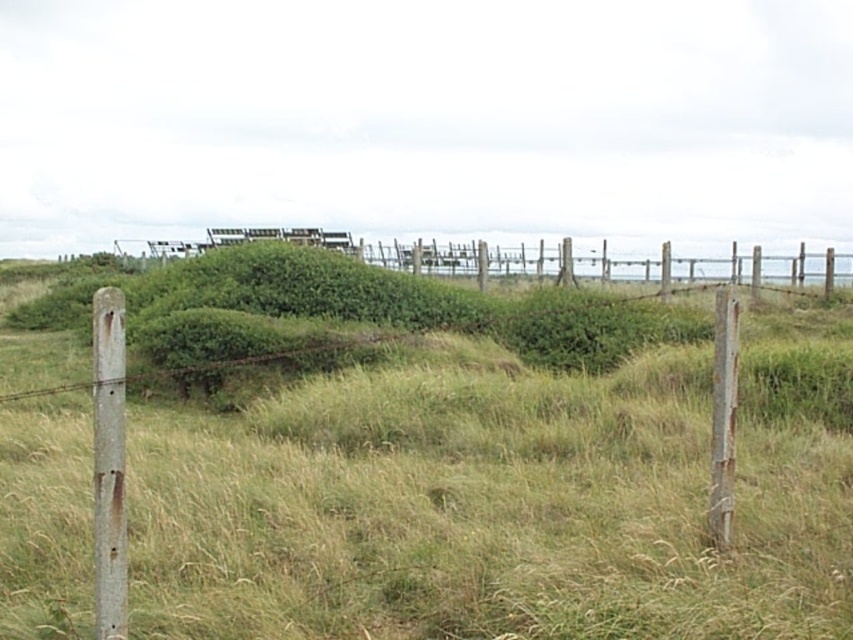
Question: Estimate the real-world distances between objects in this image. Which object is farther from the rusty metal fence at upper center?

Choices:
 (A) rusty metal pole at left
 (B) rusty wood post at right
 (C) green grassy at center

Answer: (B)

Question: Which object is positioned closest to the rusty metal pole at left?

Choices:
 (A) rusty metal fence at upper center
 (B) rusty wood post at right
 (C) green grassy at center

Answer: (B)

Question: Does rusty metal fence at upper center have a smaller size compared to rusty metal pole at left?

Choices:
 (A) yes
 (B) no

Answer: (B)

Question: Among these points, which one is nearest to the camera?

Choices:
 (A) (815, 490)
 (B) (120, 296)
 (C) (463, 266)
 (D) (721, 356)

Answer: (B)

Question: Can you confirm if green grassy at center is positioned to the left of rusty wood post at right?

Choices:
 (A) yes
 (B) no

Answer: (A)

Question: Is green grassy at center positioned in front of rusty wood post at right?

Choices:
 (A) yes
 (B) no

Answer: (A)